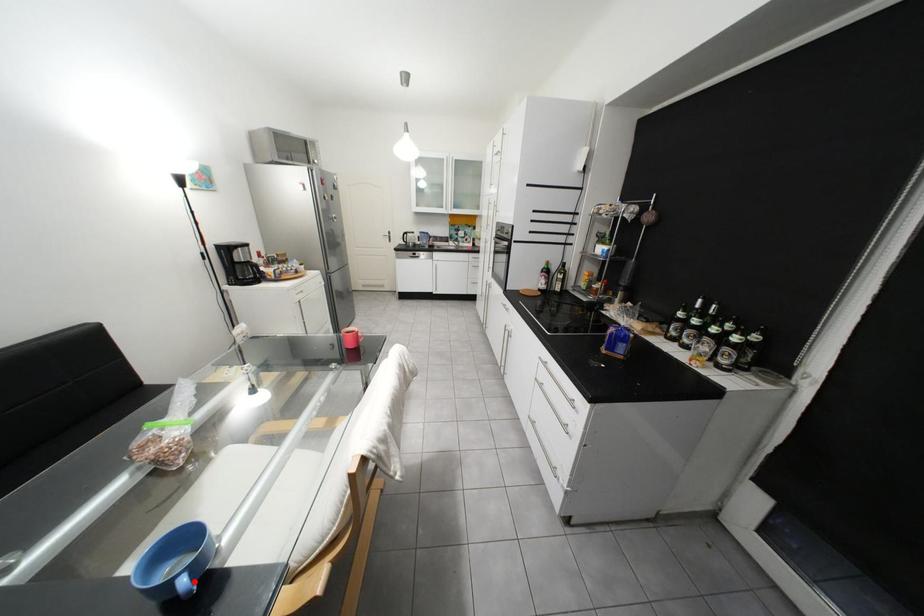
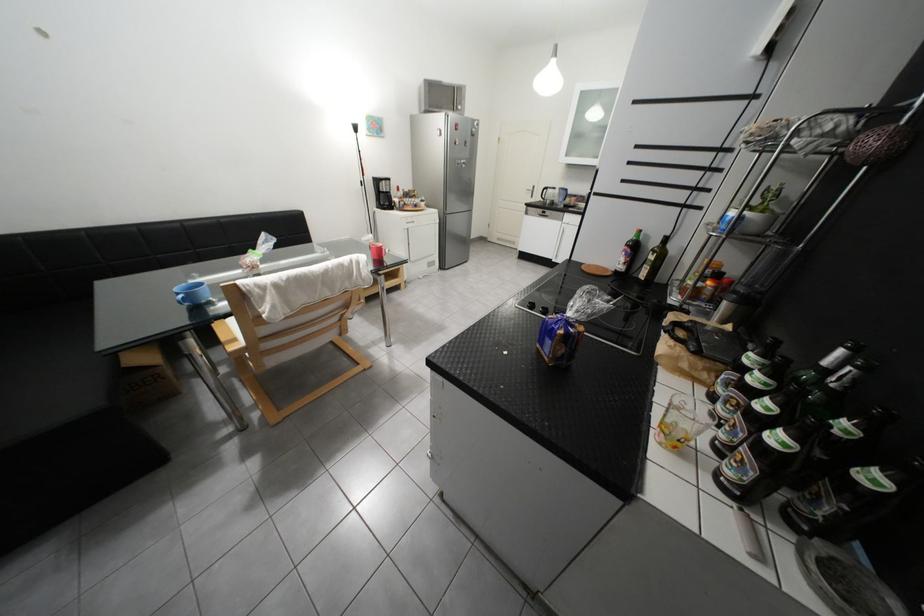
Where in the second image is the point corresponding to the highlighted location from the first image?

(192, 297)